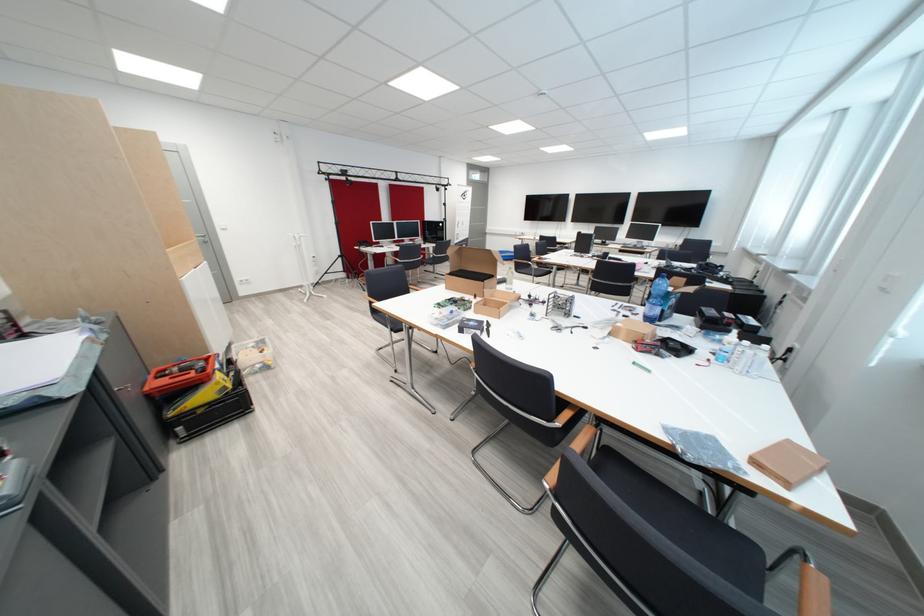
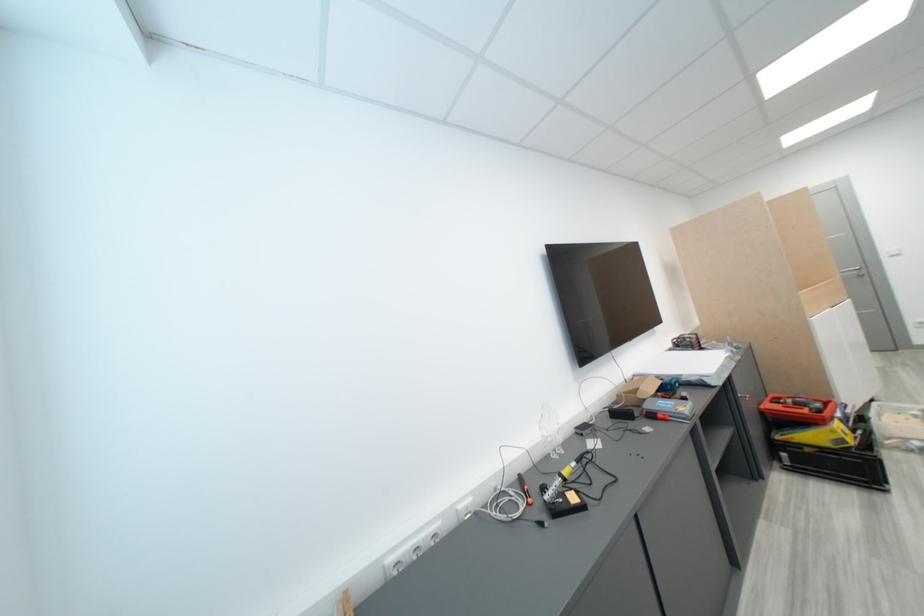
Find the pixel in the second image that matches pixel 159 398 in the first image.

(772, 416)